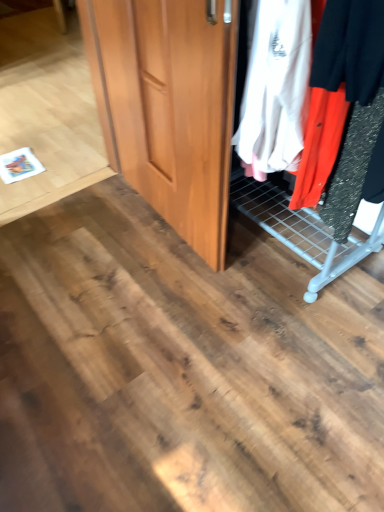
You are a GUI agent. You are given a task and a screenshot of the screen. Output one action in this format:
    pyautogui.click(x=<x>, y=<y>)
    Task: Click on the free region under wooden door at center (from a real-world perspective)
    Image resolution: width=384 pixels, height=512 pixels.
    Given the screenshot: What is the action you would take?
    pyautogui.click(x=159, y=219)